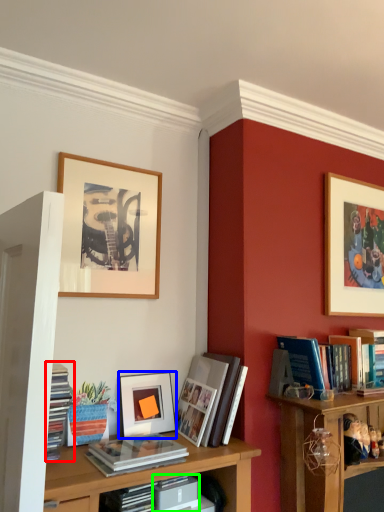
Question: Which is farther away from book (highlighted by a red box)? picture frame (highlighted by a blue box) or paperback book (highlighted by a green box)?

Choices:
 (A) picture frame
 (B) paperback book

Answer: (B)